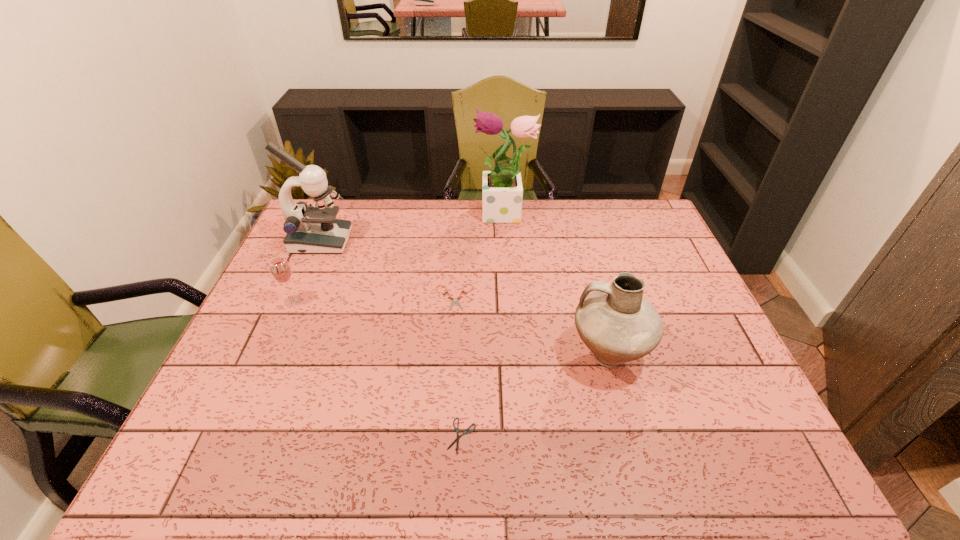
The width and height of the screenshot is (960, 540). I want to click on microscope that is at the far edge, so click(x=310, y=229).

Find the location of a particular element. object that is at the near edge is located at coordinates (465, 432).

The width and height of the screenshot is (960, 540). What are the coordinates of `microscope located in the left edge section of the desktop` in the screenshot? It's located at (310, 229).

You are a GUI agent. You are given a task and a screenshot of the screen. Output one action in this format:
    pyautogui.click(x=<x>, y=<y>)
    Task: Click on the wineglass that is at the left edge
    
    Given the screenshot: What is the action you would take?
    pyautogui.click(x=281, y=271)

At what (x,y) coordinates should I click in order to perform the action: click on object that is at the far left corner. Please return your answer as a coordinate pair (x, y). Image resolution: width=960 pixels, height=540 pixels. Looking at the image, I should click on (310, 229).

The image size is (960, 540). What are the coordinates of `vacant space at the far edge of the desktop` in the screenshot? It's located at (384, 206).

Locate an element on the screen. The width and height of the screenshot is (960, 540). blank space at the near edge of the desktop is located at coordinates (454, 459).

You are a GUI agent. You are given a task and a screenshot of the screen. Output one action in this format:
    pyautogui.click(x=<x>, y=<y>)
    Task: Click on the vacant space at the right edge
    The width and height of the screenshot is (960, 540).
    Given the screenshot: What is the action you would take?
    tap(727, 408)

Image resolution: width=960 pixels, height=540 pixels. In order to click on free space at the far right corner of the desktop in this screenshot , I will do `click(612, 211)`.

The image size is (960, 540). In order to click on free space between the rightmost object and the shortest object in this screenshot , I will do `click(535, 395)`.